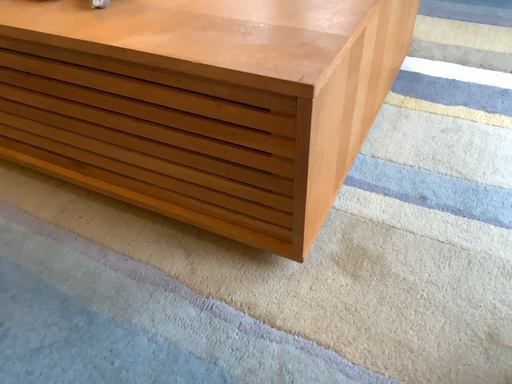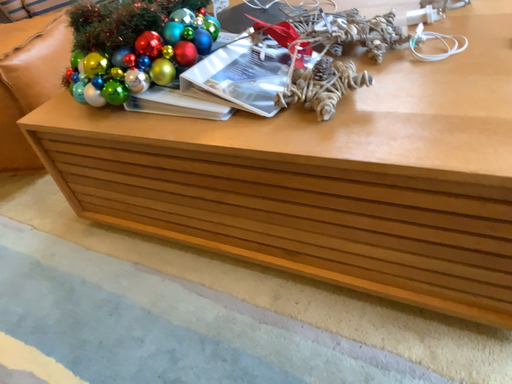
Question: Which way did the camera rotate in the video?

Choices:
 (A) rotated left
 (B) rotated right

Answer: (A)